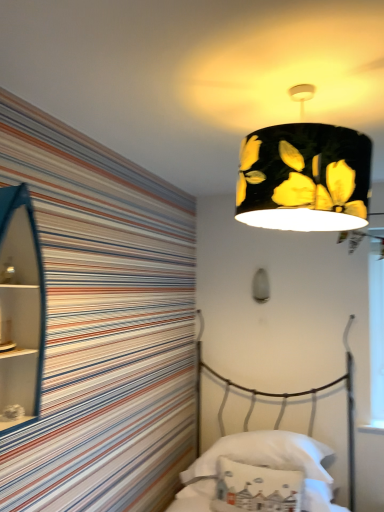
Question: Would you say white fabric pillow at lower center, which is the 1th pillow in front-to-back order, is outside white fabric pillow at lower center, acting as the first pillow starting from the back?

Choices:
 (A) yes
 (B) no

Answer: (A)

Question: Considering the relative sizes of white fabric pillow at lower center, which is the 1th pillow in front-to-back order, and white fabric pillow at lower center, acting as the first pillow starting from the back, in the image provided, is white fabric pillow at lower center, which is the 1th pillow in front-to-back order, taller than white fabric pillow at lower center, acting as the first pillow starting from the back,?

Choices:
 (A) yes
 (B) no

Answer: (A)

Question: Is white fabric pillow at lower center, which is the 2th pillow from back to front, smaller than white fabric pillow at lower center, acting as the first pillow starting from the back?

Choices:
 (A) no
 (B) yes

Answer: (B)

Question: Can you confirm if white fabric pillow at lower center, which is the 2th pillow from back to front, is positioned to the left of white fabric pillow at lower center, the second pillow viewed from the front?

Choices:
 (A) yes
 (B) no

Answer: (A)

Question: From the image's perspective, is white fabric pillow at lower center, which is the 2th pillow from back to front, located above white fabric pillow at lower center, the second pillow viewed from the front?

Choices:
 (A) yes
 (B) no

Answer: (A)

Question: Is white fabric pillow at lower center, the second pillow viewed from the front, surrounded by white fabric pillow at lower center, which is the 2th pillow from back to front?

Choices:
 (A) yes
 (B) no

Answer: (B)

Question: Does satin white lampshade at upper center, the 2th lamp when ordered from front to back, have a smaller size compared to white fabric pillow at lower center, which is the 2th pillow from back to front?

Choices:
 (A) yes
 (B) no

Answer: (A)

Question: From the image's perspective, is satin white lampshade at upper center, the 2th lamp when ordered from front to back, below white fabric pillow at lower center, which is the 2th pillow from back to front?

Choices:
 (A) yes
 (B) no

Answer: (B)

Question: Is satin white lampshade at upper center, the 2th lamp positioned from the top, surrounding white fabric pillow at lower center, which is the 1th pillow in front-to-back order?

Choices:
 (A) yes
 (B) no

Answer: (B)

Question: Is satin white lampshade at upper center, which appears as the 1th lamp when ordered from the bottom, positioned before white fabric pillow at lower center, which is the 1th pillow in front-to-back order?

Choices:
 (A) yes
 (B) no

Answer: (B)

Question: Is satin white lampshade at upper center, which appears as the 1th lamp when ordered from the bottom, oriented towards white fabric pillow at lower center, which is the 1th pillow in front-to-back order?

Choices:
 (A) yes
 (B) no

Answer: (B)

Question: Can you confirm if satin white lampshade at upper center, which appears as the 1th lamp when ordered from the bottom, is thinner than white fabric pillow at lower center, which is the 2th pillow from back to front?

Choices:
 (A) no
 (B) yes

Answer: (B)

Question: Is blue glossy cabinet at left surrounded by black matte lampshade at upper center, which ranks as the second lamp in back-to-front order?

Choices:
 (A) yes
 (B) no

Answer: (B)